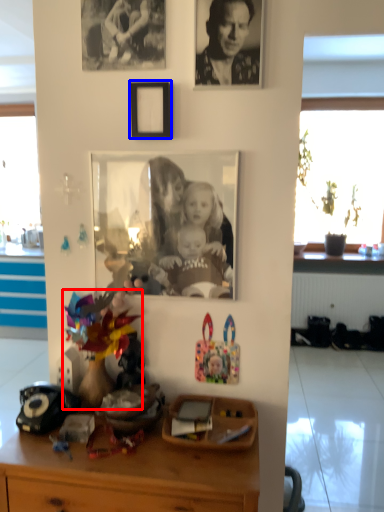
Question: Which of the following is the farthest to the observer, toy (highlighted by a red box) or picture frame (highlighted by a blue box)?

Choices:
 (A) toy
 (B) picture frame

Answer: (B)